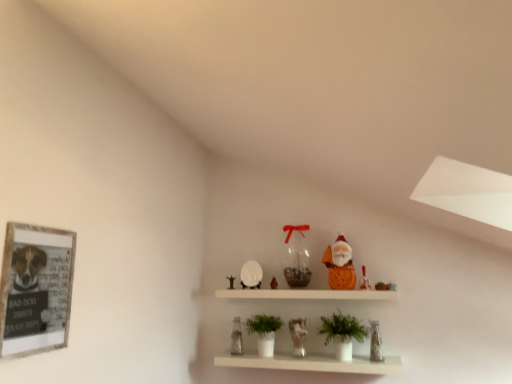
Image resolution: width=512 pixels, height=384 pixels. What are the coordinates of `translucent glass vase at center, placed as the fifth toy when sorted from right to left` in the screenshot? It's located at (295, 256).

How much space does orange fabric santa at upper center, positioned as the third toy in right-to-left order, occupy horizontally?

It is 7.87 inches.

Where is `clear glass vase at lower center, positioned as the 7th toy in right-to-left order`? This screenshot has width=512, height=384. clear glass vase at lower center, positioned as the 7th toy in right-to-left order is located at coordinates (236, 337).

Where is `white matte shelf at center`? This screenshot has width=512, height=384. white matte shelf at center is located at coordinates (311, 362).

The height and width of the screenshot is (384, 512). What do you see at coordinates (343, 333) in the screenshot?
I see `green matte plant at center, which ranks as the first houseplant in right-to-left order` at bounding box center [343, 333].

Find the location of a particular element. Image resolution: width=512 pixels, height=384 pixels. translucent glass vase at lower right, marked as the seventh toy in a left-to-right arrangement is located at coordinates (375, 342).

Image resolution: width=512 pixels, height=384 pixels. I want to click on translucent glass vase at center, placed as the fifth toy when sorted from right to left, so click(x=295, y=256).

Between white glossy ceramic horse at center, arranged as the fourth toy when viewed from the right, and orange fabric santa at upper center, which is counted as the fifth toy, starting from the left, which one has smaller size?

white glossy ceramic horse at center, arranged as the fourth toy when viewed from the right, is smaller.

Consider the image. Is white glossy ceramic horse at center, arranged as the fourth toy when viewed from the right, completely or partially outside of orange fabric santa at upper center, which is counted as the fifth toy, starting from the left?

Yes, white glossy ceramic horse at center, arranged as the fourth toy when viewed from the right, is not within orange fabric santa at upper center, which is counted as the fifth toy, starting from the left.

From the orange fabric santa at upper center, which is counted as the fifth toy, starting from the left, count 1st toys backward and point to it. Please provide its 2D coordinates.

[(298, 336)]

Is white glossy ceramic horse at center, arranged as the fourth toy when viewed from the right, closer to the viewer compared to orange fabric santa at upper center, positioned as the third toy in right-to-left order?

No, white glossy ceramic horse at center, arranged as the fourth toy when viewed from the right, is behind orange fabric santa at upper center, positioned as the third toy in right-to-left order.

Choose the correct answer: Is orange fabric santa at upper center, which is counted as the fifth toy, starting from the left, inside white matte vase at center, the second houseplant viewed from the right, or outside it?

orange fabric santa at upper center, which is counted as the fifth toy, starting from the left, is outside white matte vase at center, the second houseplant viewed from the right.

From a real-world perspective, is orange fabric santa at upper center, which is counted as the fifth toy, starting from the left, on top of white matte vase at center, positioned as the first houseplant in left-to-right order?

Indeed, from a real-world perspective, orange fabric santa at upper center, which is counted as the fifth toy, starting from the left, stands above white matte vase at center, positioned as the first houseplant in left-to-right order.

Is orange fabric santa at upper center, which is counted as the fifth toy, starting from the left, aimed at white matte vase at center, the second houseplant viewed from the right?

No, orange fabric santa at upper center, which is counted as the fifth toy, starting from the left, is not turned towards white matte vase at center, the second houseplant viewed from the right.

Is matte orange santa at upper center, which is the second toy in right-to-left order, at the left side of clear glass vase at lower center, placed as the 1th toy when sorted from left to right?

No.

Could you tell me if matte orange santa at upper center, positioned as the sixth toy in left-to-right order, is turned towards clear glass vase at lower center, positioned as the 7th toy in right-to-left order?

No, matte orange santa at upper center, positioned as the sixth toy in left-to-right order, is not aimed at clear glass vase at lower center, positioned as the 7th toy in right-to-left order.

Who is shorter, matte orange santa at upper center, which is the second toy in right-to-left order, or clear glass vase at lower center, positioned as the 7th toy in right-to-left order?

Standing shorter between the two is matte orange santa at upper center, which is the second toy in right-to-left order.

Which is less distant, (50, 238) or (339, 318)?

Positioned in front is point (50, 238).

Which of these two, wooden framed poster at left or green matte plant at center, which ranks as the first houseplant in right-to-left order, is smaller?

wooden framed poster at left.

Considering the sizes of objects wooden framed poster at left and green matte plant at center, which ranks as the first houseplant in right-to-left order, in the image provided, who is wider, wooden framed poster at left or green matte plant at center, which ranks as the first houseplant in right-to-left order,?

Wider between the two is green matte plant at center, which ranks as the first houseplant in right-to-left order.

How many degrees apart are the facing directions of wooden framed poster at left and green matte plant at center, which ranks as the first houseplant in right-to-left order?

The facing directions of wooden framed poster at left and green matte plant at center, which ranks as the first houseplant in right-to-left order, are 90.4 degrees apart.

Does matte orange santa at upper center, which is the second toy in right-to-left order, have a lesser width compared to wooden framed poster at left?

Incorrect, the width of matte orange santa at upper center, which is the second toy in right-to-left order, is not less than that of wooden framed poster at left.

Is the position of matte orange santa at upper center, positioned as the sixth toy in left-to-right order, less distant than that of wooden framed poster at left?

No, it is not.

Is matte orange santa at upper center, positioned as the sixth toy in left-to-right order, aimed at wooden framed poster at left?

No, matte orange santa at upper center, positioned as the sixth toy in left-to-right order, is not oriented towards wooden framed poster at left.

From the image's perspective, is matte orange santa at upper center, positioned as the sixth toy in left-to-right order, beneath wooden framed poster at left?

Correct, matte orange santa at upper center, positioned as the sixth toy in left-to-right order, appears lower than wooden framed poster at left in the image.

Find the location of a particular element. This screenshot has width=512, height=384. picture frame to the left of white matte vase at center, positioned as the first houseplant in left-to-right order is located at coordinates (35, 289).

Would you say wooden framed poster at left contains white matte vase at center, positioned as the first houseplant in left-to-right order?

No, white matte vase at center, positioned as the first houseplant in left-to-right order, is not inside wooden framed poster at left.

Which object is positioned more to the right, wooden framed poster at left or white matte vase at center, positioned as the first houseplant in left-to-right order?

Positioned to the right is white matte vase at center, positioned as the first houseplant in left-to-right order.

From a real-world perspective, is wooden framed poster at left under white matte vase at center, positioned as the first houseplant in left-to-right order?

No, from a real-world perspective, wooden framed poster at left is not under white matte vase at center, positioned as the first houseplant in left-to-right order.

Is green matte plant at center, which ranks as the first houseplant in right-to-left order, next to translucent glass vase at lower right, marked as the seventh toy in a left-to-right arrangement?

No, green matte plant at center, which ranks as the first houseplant in right-to-left order, is not touching translucent glass vase at lower right, marked as the seventh toy in a left-to-right arrangement.

Is green matte plant at center, which ranks as the first houseplant in right-to-left order, facing towards translucent glass vase at lower right, marked as the seventh toy in a left-to-right arrangement?

No, green matte plant at center, which ranks as the first houseplant in right-to-left order, is not aimed at translucent glass vase at lower right, marked as the seventh toy in a left-to-right arrangement.

From a real-world perspective, is green matte plant at center, which is counted as the 2th houseplant, starting from the left, positioned above or below translucent glass vase at lower right, which appears as the 1th toy when viewed from the right?

green matte plant at center, which is counted as the 2th houseplant, starting from the left, is above translucent glass vase at lower right, which appears as the 1th toy when viewed from the right.

The width and height of the screenshot is (512, 384). Identify the location of houseplant in front of the translucent glass vase at lower right, marked as the seventh toy in a left-to-right arrangement. (343, 333).

Starting from the white glossy ceramic horse at center, the 4th toy when ordered from left to right, which toy is the 1st one in front? Please provide its 2D coordinates.

[(340, 265)]

There is a orange fabric santa at upper center, which is counted as the fifth toy, starting from the left. At what (x,y) coordinates should I click in order to perform the action: click on the 2nd houseplant below it (from the image's perspective). Please return your answer as a coordinate pair (x, y). Looking at the image, I should click on (264, 332).

Which object lies nearer to the anchor point translucent glass vase at lower right, marked as the seventh toy in a left-to-right arrangement, white matte vase at center, the second houseplant viewed from the right, or matte glass jar at center, which appears as the 2th toy when viewed from the left?

white matte vase at center, the second houseplant viewed from the right, is closer to translucent glass vase at lower right, marked as the seventh toy in a left-to-right arrangement.

Looking at the image, which one is located further to green matte plant at center, which ranks as the first houseplant in right-to-left order, orange fabric santa at upper center, which is counted as the fifth toy, starting from the left, or translucent glass vase at center, placed as the fifth toy when sorted from right to left?

translucent glass vase at center, placed as the fifth toy when sorted from right to left, is positioned further to the anchor green matte plant at center, which ranks as the first houseplant in right-to-left order.

Considering their positions, is green matte plant at center, which ranks as the first houseplant in right-to-left order, positioned further to wooden framed poster at left than translucent glass vase at lower right, which appears as the 1th toy when viewed from the right?

Based on the image, translucent glass vase at lower right, which appears as the 1th toy when viewed from the right, appears to be further to wooden framed poster at left.

Looking at the image, which one is located further to translucent glass vase at center, placed as the fifth toy when sorted from right to left, white glossy ceramic horse at center, arranged as the fourth toy when viewed from the right, or clear glass vase at lower center, placed as the 1th toy when sorted from left to right?

Based on the image, clear glass vase at lower center, placed as the 1th toy when sorted from left to right, appears to be further to translucent glass vase at center, placed as the fifth toy when sorted from right to left.

Based on their spatial positions, is wooden framed poster at left or translucent glass vase at center, placed as the fifth toy when sorted from right to left, further from translucent glass vase at lower right, marked as the seventh toy in a left-to-right arrangement?

Result: wooden framed poster at left is further to translucent glass vase at lower right, marked as the seventh toy in a left-to-right arrangement.

From the image, which object appears to be nearer to white matte vase at center, the second houseplant viewed from the right, orange fabric santa at upper center, which is counted as the fifth toy, starting from the left, or white matte shelf at center?

white matte shelf at center.

In the scene shown: From the image, which object appears to be farther from green matte plant at center, which is counted as the 2th houseplant, starting from the left, white matte vase at center, the second houseplant viewed from the right, or matte glass jar at center, which appears as the 2th toy when viewed from the left?

Based on the image, matte glass jar at center, which appears as the 2th toy when viewed from the left, appears to be further to green matte plant at center, which is counted as the 2th houseplant, starting from the left.

When comparing their distances from white matte shelf at center, does white glossy ceramic horse at center, the 4th toy when ordered from left to right, or translucent glass vase at center, the third toy positioned from the left, seem closer?

white glossy ceramic horse at center, the 4th toy when ordered from left to right, lies closer to white matte shelf at center than the other object.

At what (x,y) coordinates should I click in order to perform the action: click on houseplant situated between matte glass jar at center, which ranks as the sixth toy in right-to-left order, and orange fabric santa at upper center, positioned as the third toy in right-to-left order, from left to right. Please return your answer as a coordinate pair (x, y). Looking at the image, I should click on (343, 333).

Where is `shelf between white matte vase at center, the second houseplant viewed from the right, and green matte plant at center, which ranks as the first houseplant in right-to-left order`? The height and width of the screenshot is (384, 512). shelf between white matte vase at center, the second houseplant viewed from the right, and green matte plant at center, which ranks as the first houseplant in right-to-left order is located at coordinates click(x=311, y=362).

Locate an element on the screen. The height and width of the screenshot is (384, 512). shelf located between white glossy ceramic horse at center, the 4th toy when ordered from left to right, and translucent glass vase at lower right, which appears as the 1th toy when viewed from the right, in the left-right direction is located at coordinates (311, 362).

Locate an element on the screen. houseplant between orange fabric santa at upper center, positioned as the third toy in right-to-left order, and white glossy ceramic horse at center, the 4th toy when ordered from left to right, in the up-down direction is located at coordinates [x=343, y=333].